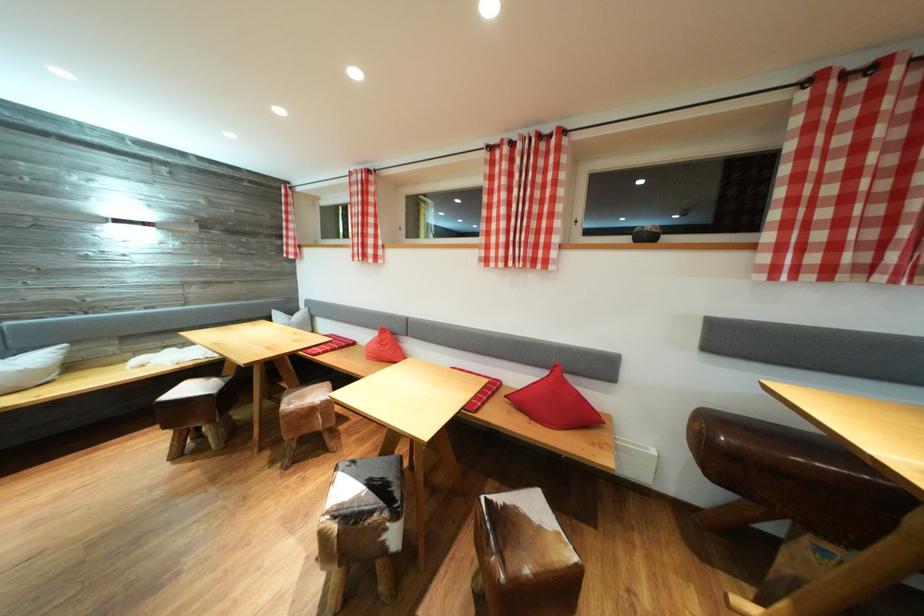
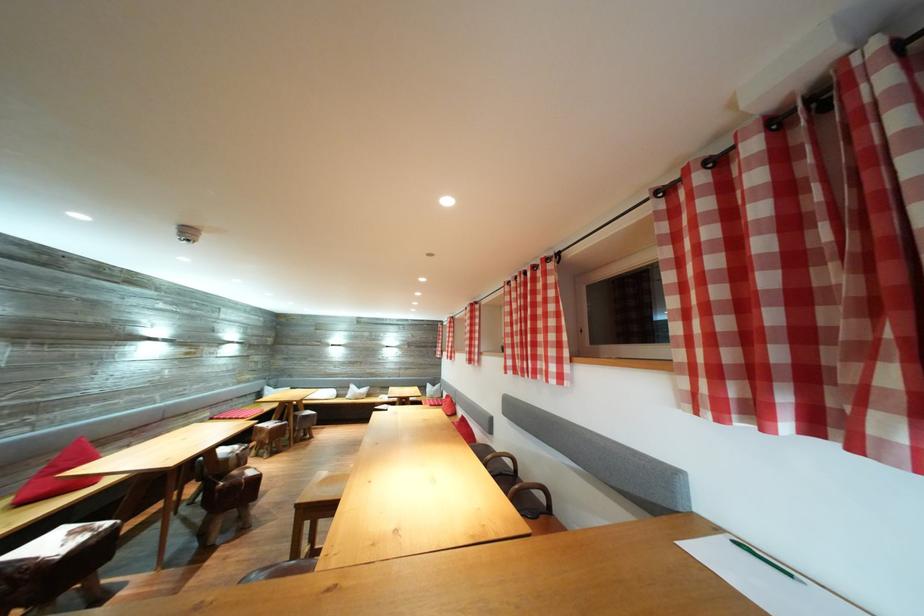
Locate, in the second image, the point that corresponds to point (79, 371) in the first image.

(375, 400)